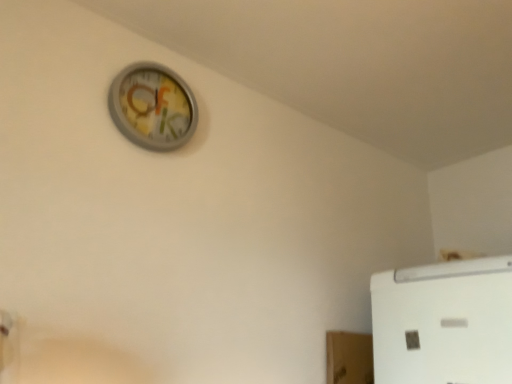
Image resolution: width=512 pixels, height=384 pixels. Describe the element at coordinates (153, 106) in the screenshot. I see `metallic silver clock at upper left` at that location.

What is the approximate width of metallic silver clock at upper left?

metallic silver clock at upper left is 1.86 inches wide.

The image size is (512, 384). I want to click on metallic silver clock at upper left, so click(153, 106).

Where is `metallic silver clock at upper left`? The image size is (512, 384). metallic silver clock at upper left is located at coordinates (153, 106).